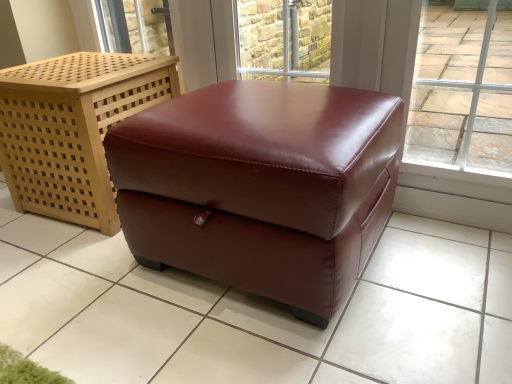
The height and width of the screenshot is (384, 512). Identify the location of free space to the left of glossy leather ottoman at center. (79, 290).